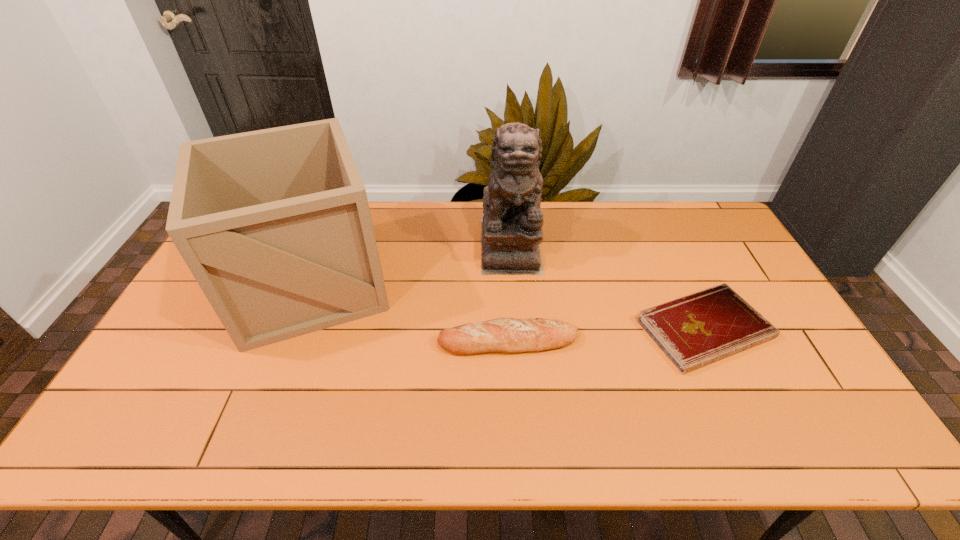
In order to click on box that is at the far edge in this screenshot , I will do `click(274, 224)`.

You are a GUI agent. You are given a task and a screenshot of the screen. Output one action in this format:
    pyautogui.click(x=<x>, y=<y>)
    Task: Click on the object that is at the left edge
    The width and height of the screenshot is (960, 540).
    Given the screenshot: What is the action you would take?
    pyautogui.click(x=274, y=224)

The height and width of the screenshot is (540, 960). Find the location of `object that is positioned at the right edge`. object that is positioned at the right edge is located at coordinates (696, 330).

The width and height of the screenshot is (960, 540). I want to click on object that is at the far left corner, so click(x=274, y=224).

Locate an element on the screen. This screenshot has height=540, width=960. free region at the far edge of the desktop is located at coordinates (649, 234).

In order to click on blank area at the near edge in this screenshot , I will do `click(443, 427)`.

Identify the location of free region at the far right corner of the desktop. This screenshot has height=540, width=960. (713, 209).

Identify the location of free region at the near right corner. (851, 437).

Identify the location of vacant space that is in between the leftmost object and the shortest object. (507, 306).

Locate an element on the screen. This screenshot has width=960, height=540. vacant area between the baguet and the sculpture is located at coordinates (510, 292).